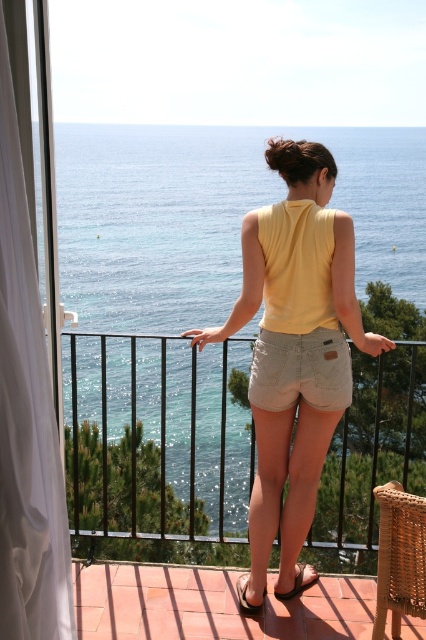
Question: Is black metal railing at center below yellow cotton tank top at center?

Choices:
 (A) yes
 (B) no

Answer: (A)

Question: Which point is farther to the camera?

Choices:
 (A) 241,586
 (B) 293,593

Answer: (A)

Question: Which point appears farthest from the camera in this image?

Choices:
 (A) (339, 372)
 (B) (199, 205)
 (C) (241, 316)

Answer: (B)

Question: Which point is closer to the camera taking this photo?

Choices:
 (A) (284, 596)
 (B) (256, 420)
 (C) (247, 340)

Answer: (B)

Question: In this image, where is black metal railing at center located relative to brown leather sandal at lower center?

Choices:
 (A) above
 (B) below

Answer: (B)

Question: Is yellow cotton tank top at center to the left of brown leather sandal at lower center from the viewer's perspective?

Choices:
 (A) yes
 (B) no

Answer: (B)